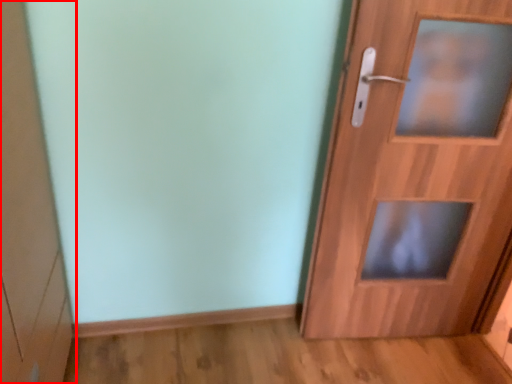
Question: From the image's perspective, what is the correct spatial relationship of cabinetry (annotated by the red box) in relation to door?

Choices:
 (A) above
 (B) below

Answer: (B)